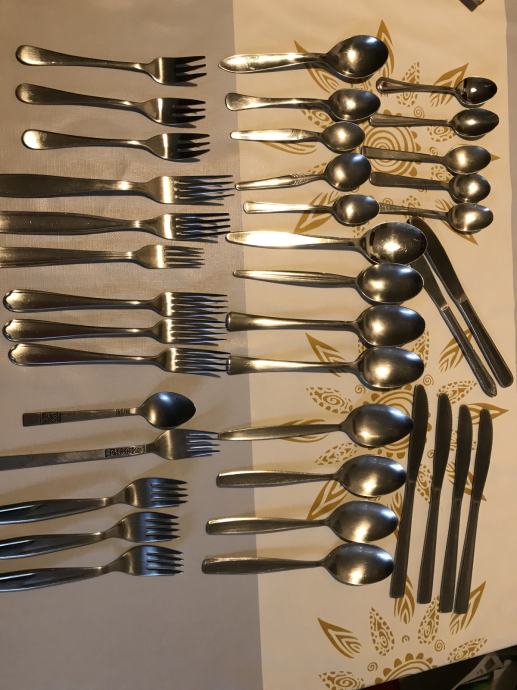
I want to click on butter knives, so [433, 294], [445, 276], [417, 440], [439, 453], [460, 464], [480, 471].